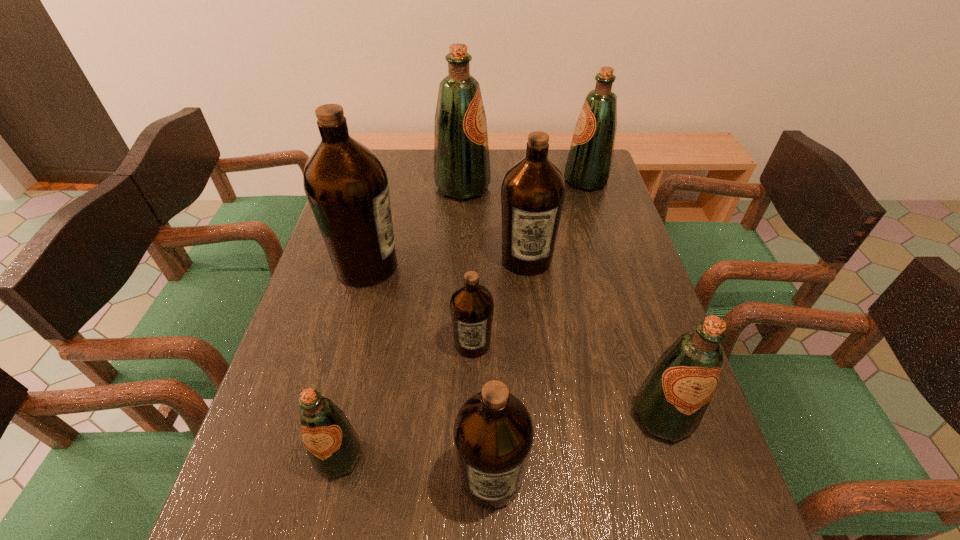
Choose which object is the seventh nearest neighbor to the nearest brown olive oil. Please provide its 2D coordinates. Your answer should be formatted as a tuple, i.e. [(x, y)], where the tuple contains the x and y coordinates of a point satisfying the conditions above.

[(588, 167)]

Where is `the closest object relative to the leftmost brown olive oil`? The height and width of the screenshot is (540, 960). the closest object relative to the leftmost brown olive oil is located at coordinates (471, 305).

The width and height of the screenshot is (960, 540). Identify the location of olive oil that stands as the fourth closest to the second biggest brown olive oil. (345, 182).

At what (x,y) coordinates should I click in order to perform the action: click on the fifth closest olive oil to the nearest brown olive oil. Please return your answer as a coordinate pair (x, y). Image resolution: width=960 pixels, height=540 pixels. Looking at the image, I should click on (533, 191).

Find the location of a particular element. The width and height of the screenshot is (960, 540). green olive oil that is the closest to the third biggest brown olive oil is located at coordinates (333, 446).

You are a GUI agent. You are given a task and a screenshot of the screen. Output one action in this format:
    pyautogui.click(x=<x>, y=<y>)
    Task: Click on the fourth closest green olive oil to the third smallest brown olive oil
    Image resolution: width=960 pixels, height=540 pixels.
    Given the screenshot: What is the action you would take?
    coord(333,446)

Where is `brown olive oil that can be found as the closest to the biggest brown olive oil`? The height and width of the screenshot is (540, 960). brown olive oil that can be found as the closest to the biggest brown olive oil is located at coordinates (471, 305).

Locate which brown olive oil is the third closest to the third biggest brown olive oil. Please provide its 2D coordinates. Your answer should be formatted as a tuple, i.e. [(x, y)], where the tuple contains the x and y coordinates of a point satisfying the conditions above.

[(533, 191)]

Locate an element on the screen. vacant area in the image that satisfies the following two spatial constraints: 1. on the front-facing side of the third smallest green olive oil; 2. on the front-facing side of the smallest green olive oil is located at coordinates (670, 456).